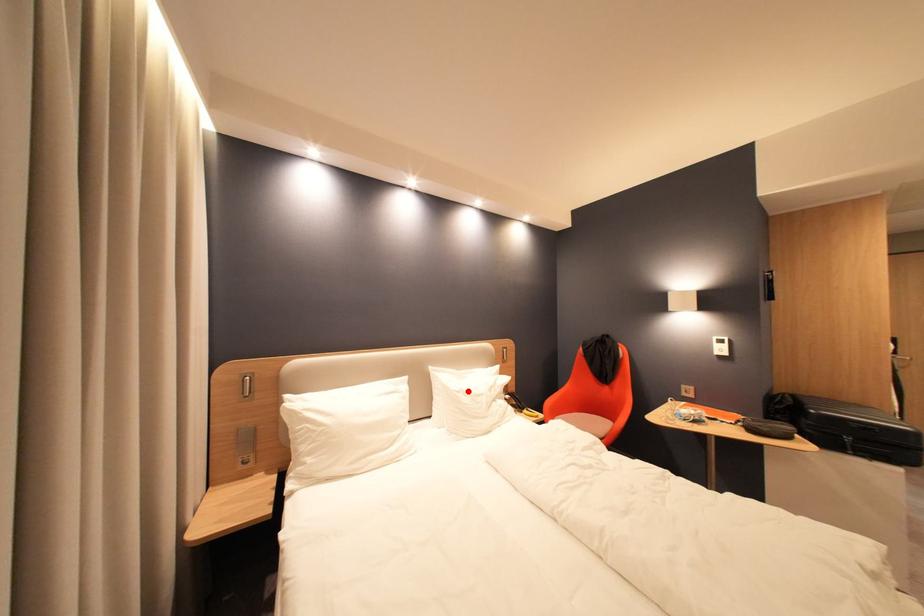
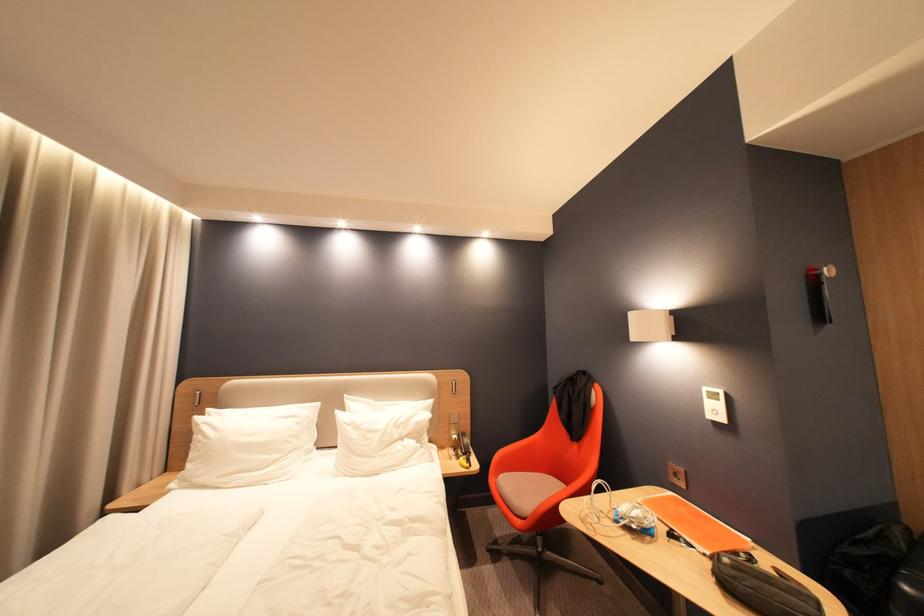
Locate, in the second image, the point that corresponds to the highlighted location in the first image.

(359, 424)